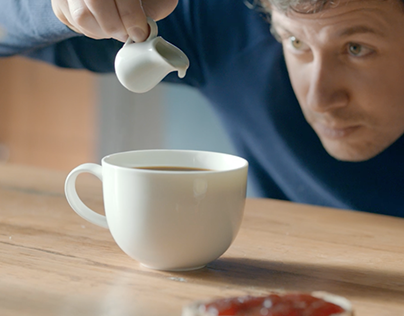
Where is `white teacup`? Image resolution: width=404 pixels, height=316 pixels. white teacup is located at coordinates (185, 218).